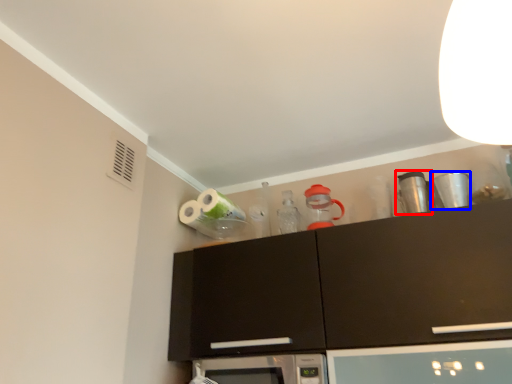
Question: Which of the following is the closest to the observer, appliance (highlighted by a red box) or appliance (highlighted by a blue box)?

Choices:
 (A) appliance
 (B) appliance

Answer: (B)